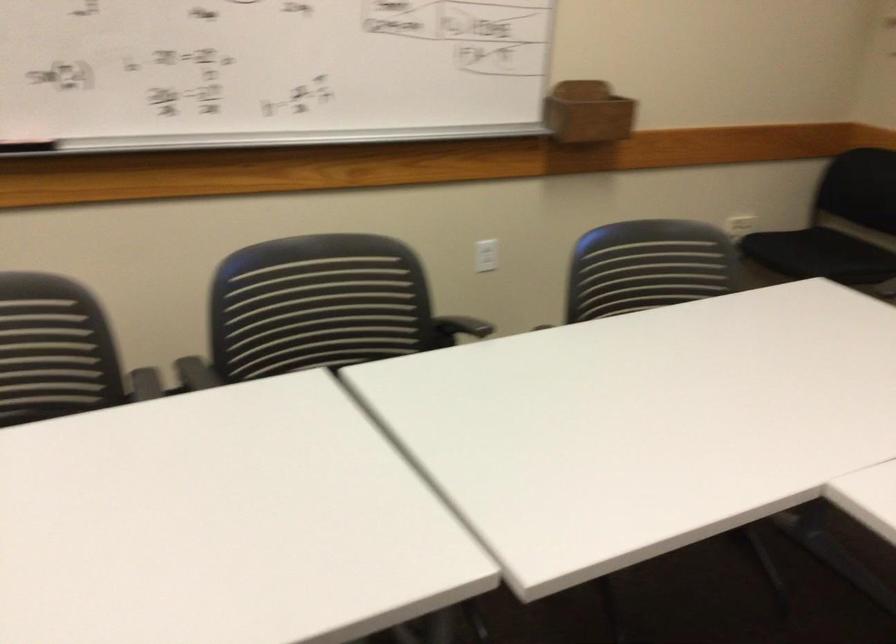
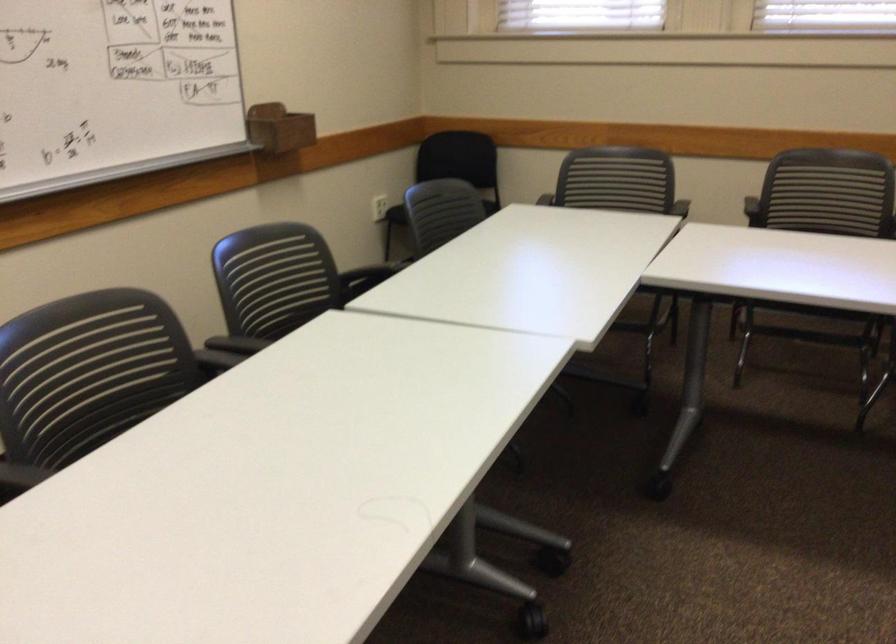
Locate, in the second image, the point that corresponds to point 383,297 in the first image.

(276, 277)